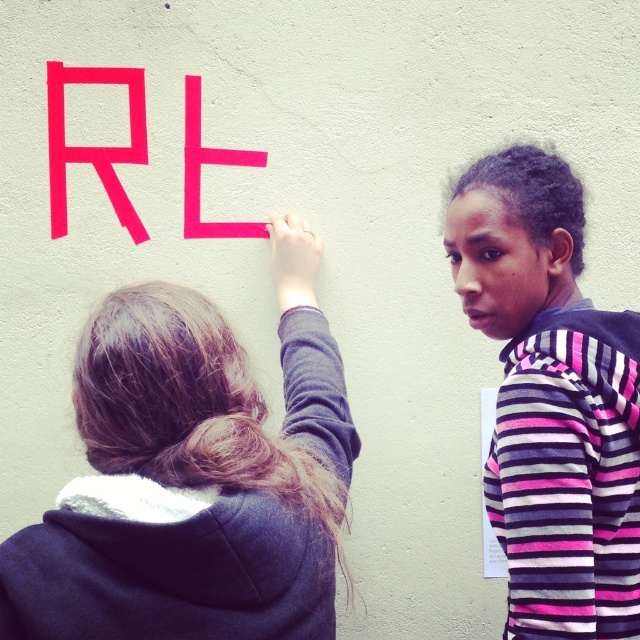
Based on the photo, between pink striped hoodie at upper right and pink matte letter e at upper center, which one has less height?

pink matte letter e at upper center is shorter.

Between point (564, 440) and point (189, 77), which one is positioned behind?

The point (189, 77) is more distant.

Locate an element on the screen. The image size is (640, 640). pink striped hoodie at upper right is located at coordinates (x=552, y=400).

Consider the image. Does dark gray hoodie at upper left appear over pink matte letter e at upper center?

Incorrect, dark gray hoodie at upper left is not positioned above pink matte letter e at upper center.

Who is positioned more to the left, dark gray hoodie at upper left or pink matte letter e at upper center?

Positioned to the left is pink matte letter e at upper center.

This screenshot has width=640, height=640. Identify the location of dark gray hoodie at upper left. (193, 476).

Does pink striped hoodie at upper right appear under pink matte letter r at upper left?

Yes, pink striped hoodie at upper right is below pink matte letter r at upper left.

Can you confirm if pink striped hoodie at upper right is thinner than pink matte letter r at upper left?

No, pink striped hoodie at upper right is not thinner than pink matte letter r at upper left.

Does point (531, 173) come behind point (48, 128)?

No.

Where is `pink striped hoodie at upper right`? pink striped hoodie at upper right is located at coordinates (552, 400).